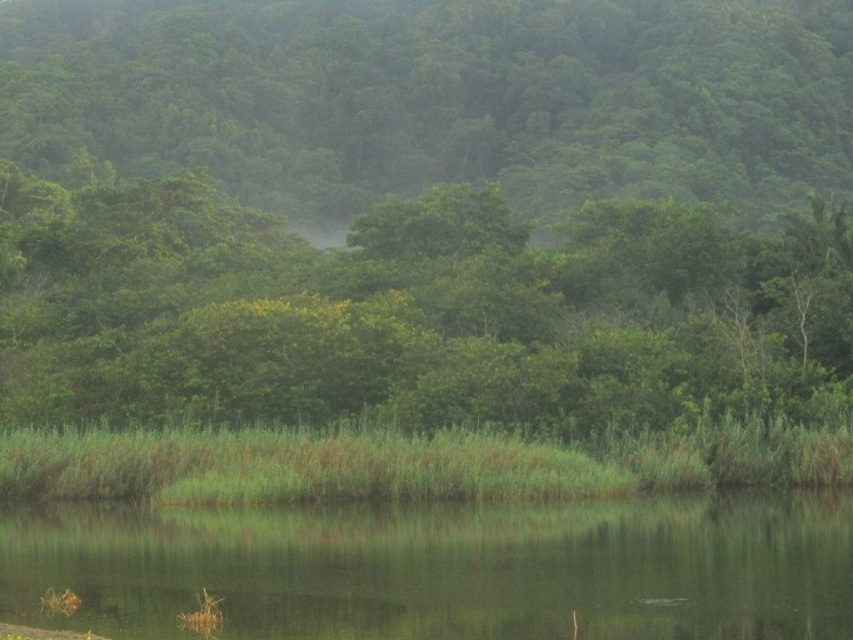
You are standing at the edge of the water and want to see the green leafy tree at center. Which direction should you look to see its reflection in the green smooth water at lower center?

The green leafy tree at center is positioned over green smooth water at lower center, so you should look downward towards the green smooth water at lower center to see its reflection.

Looking at this image, you are standing at the edge of the water in the serene natural landscape. You notice two points marked in the image. Which point, point (173, 68) or point (775, 529), is closer to you?

Point (173, 68) is closer to you because it is further to the viewer than point (775, 529).